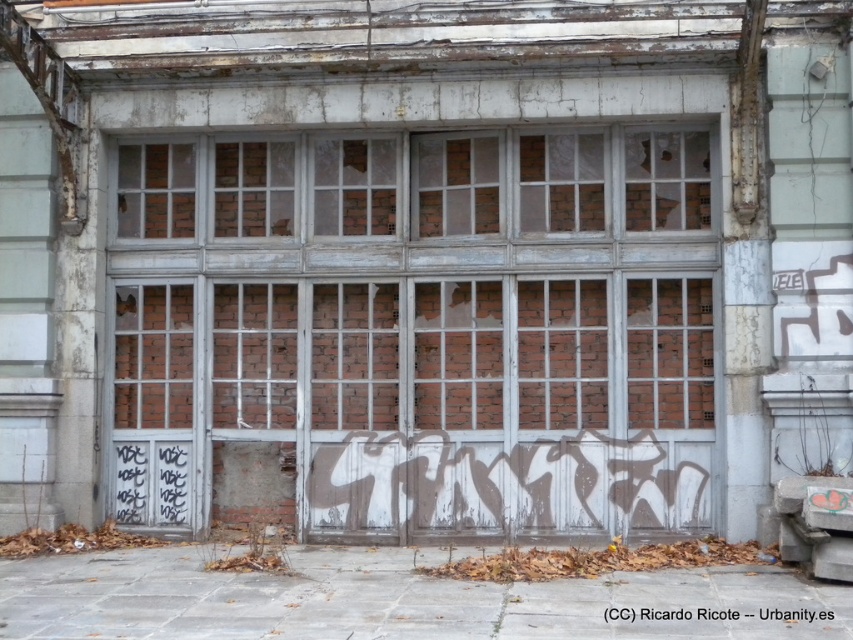
Question: Can you confirm if brick textured window at upper center is wider than translucent glass window at center?

Choices:
 (A) no
 (B) yes

Answer: (A)

Question: Which is farther from the brick wall at upper center?

Choices:
 (A) brick textured window at center
 (B) brick textured window at upper center

Answer: (B)

Question: Observing the image, what is the correct spatial positioning of translucent glass window at center in reference to brick wall at upper center?

Choices:
 (A) right
 (B) left

Answer: (A)

Question: Estimate the real-world distances between objects in this image. Which object is farther from the brick wall at upper center?

Choices:
 (A) brick textured window at upper center
 (B) brick textured window at upper left
 (C) brick wall at center
 (D) white graffiti at center

Answer: (D)

Question: Which object is the closest to the translucent glass window at center?

Choices:
 (A) white graffiti at center
 (B) brick textured window at upper left
 (C) brick textured window at center
 (D) brick textured window at upper center

Answer: (C)

Question: Does translucent glass window at center have a larger size compared to brick wall at upper center?

Choices:
 (A) no
 (B) yes

Answer: (A)